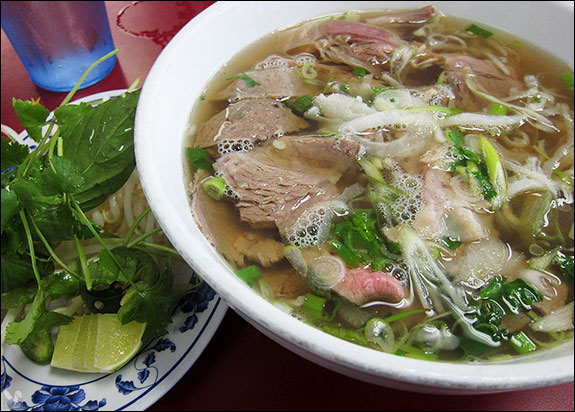
This screenshot has height=412, width=575. In order to click on shadow of bowl on tabletop in this screenshot , I will do `click(276, 366)`.